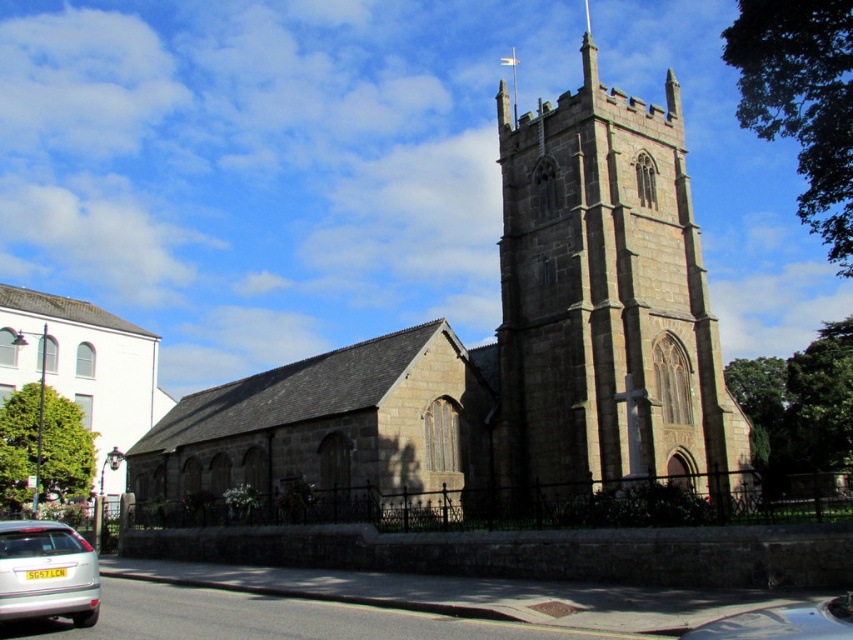
Does brown stone church at center have a lesser height compared to white smooth building at left?

In fact, brown stone church at center may be taller than white smooth building at left.

Which is in front, point (396, 339) or point (136, 422)?

Point (396, 339) is in front.

Who is more distant from viewer, (x=676, y=394) or (x=84, y=422)?

The point (x=84, y=422) is behind.

Identify the location of brown stone church at center. (502, 362).

Is white smooth building at left wider than silver metallic car at lower left?

Yes, white smooth building at left is wider than silver metallic car at lower left.

Can you confirm if white smooth building at left is smaller than silver metallic car at lower left?

Incorrect, white smooth building at left is not smaller in size than silver metallic car at lower left.

Is point (84, 348) behind point (9, 618)?

Yes.

Image resolution: width=853 pixels, height=640 pixels. In order to click on white smooth building at left in this screenshot , I will do `click(83, 364)`.

Does silver metallic car at lower left have a larger size compared to metallic silver car at lower right?

Actually, silver metallic car at lower left might be smaller than metallic silver car at lower right.

In the scene shown: Does silver metallic car at lower left have a smaller size compared to metallic silver car at lower right?

Indeed, silver metallic car at lower left has a smaller size compared to metallic silver car at lower right.

Is point (84, 620) positioned in front of point (814, 625)?

No, (84, 620) is further to viewer.

This screenshot has width=853, height=640. I want to click on silver metallic car at lower left, so click(45, 572).